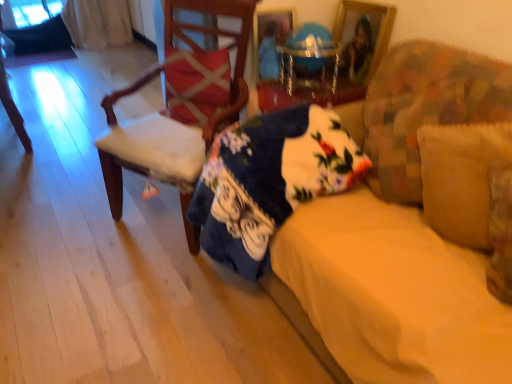
Question: Would you consider suede-like beige pillow at right, acting as the first pillow starting from the bottom, to be distant from wooden chair at left, which appears as the second chair when viewed from the left?

Choices:
 (A) yes
 (B) no

Answer: (A)

Question: Is suede-like beige pillow at right, the 2th pillow in the back-to-front sequence, taller than wooden chair at left, placed as the first chair when sorted from right to left?

Choices:
 (A) no
 (B) yes

Answer: (A)

Question: Is suede-like beige pillow at right, arranged as the first pillow when viewed from the front, smaller than wooden chair at left, placed as the first chair when sorted from right to left?

Choices:
 (A) yes
 (B) no

Answer: (A)

Question: Does suede-like beige pillow at right, positioned as the 1th pillow in right-to-left order, touch wooden chair at left, placed as the first chair when sorted from right to left?

Choices:
 (A) yes
 (B) no

Answer: (B)

Question: From the image's perspective, is suede-like beige pillow at right, positioned as the 1th pillow in right-to-left order, over wooden chair at left, which appears as the 1th chair when viewed from the front?

Choices:
 (A) no
 (B) yes

Answer: (A)

Question: Does suede-like beige pillow at right, acting as the 2th pillow starting from the left, have a lesser width compared to wooden chair at left, which is the second chair from back to front?

Choices:
 (A) no
 (B) yes

Answer: (B)

Question: Considering the relative sizes of fluffy fabric couch at center and wooden picture frame at upper center in the image provided, is fluffy fabric couch at center taller than wooden picture frame at upper center?

Choices:
 (A) no
 (B) yes

Answer: (B)

Question: Is fluffy fabric couch at center positioned with its back to wooden picture frame at upper center?

Choices:
 (A) yes
 (B) no

Answer: (B)

Question: Is fluffy fabric couch at center smaller than wooden picture frame at upper center?

Choices:
 (A) no
 (B) yes

Answer: (A)

Question: From a real-world perspective, is fluffy fabric couch at center on wooden picture frame at upper center?

Choices:
 (A) yes
 (B) no

Answer: (B)

Question: Considering the relative sizes of fluffy fabric couch at center and wooden picture frame at upper center in the image provided, is fluffy fabric couch at center thinner than wooden picture frame at upper center?

Choices:
 (A) no
 (B) yes

Answer: (A)

Question: Does fluffy fabric couch at center lie behind wooden picture frame at upper center?

Choices:
 (A) no
 (B) yes

Answer: (A)

Question: Is floral cotton blanket at center oriented towards wooden chair at left, placed as the first chair when sorted from right to left?

Choices:
 (A) yes
 (B) no

Answer: (B)